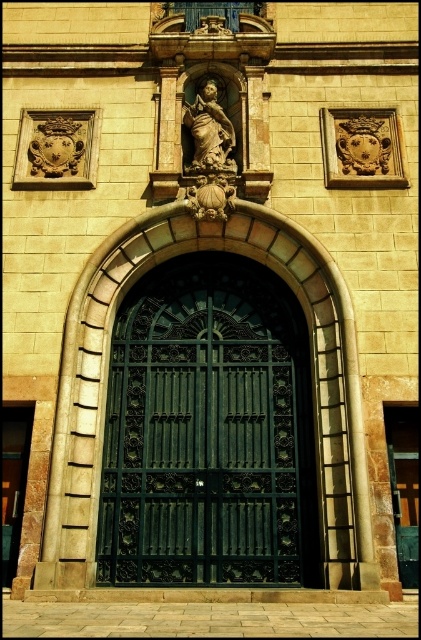
You are a visitor approaching the entrance of the building. There is a dark green wrought iron gate at center. How far apart are the two decorative panels flanking the central niche housing the statue from each other?

The two decorative panels flanking the central niche housing the statue are 40.67 meters apart.

You are a delivery person with a large package that requires a 1.2 meter wide opening to pass through. You see the dark green wrought iron gate at center and the dark green metal gate at center. Which gate should you choose to ensure your package can fit through?

The dark green wrought iron gate at center has a larger width than the dark green metal gate at center, so you should choose the dark green wrought iron gate at center to ensure your package can fit through.